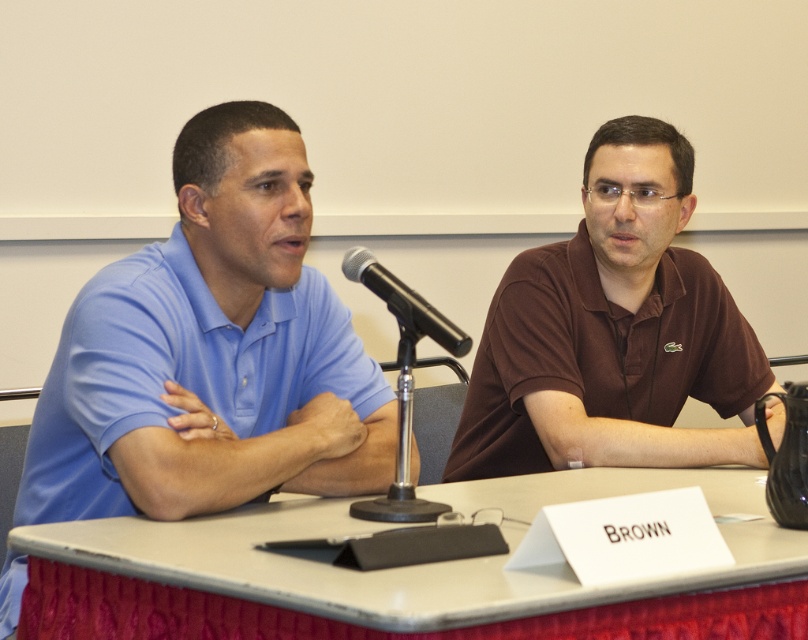
Can you confirm if matte blue polo shirt at left is positioned to the left of black metallic microphone at center?

Yes, matte blue polo shirt at left is to the left of black metallic microphone at center.

Is point (9, 593) in front of point (407, 292)?

Yes.

Locate an element on the screen. matte blue polo shirt at left is located at coordinates (x=211, y=353).

Find the location of a particular element. matte blue polo shirt at left is located at coordinates (x=211, y=353).

Which of these two, matte blue polo shirt at left or smooth white table at center, stands taller?

matte blue polo shirt at left is taller.

In order to click on matte blue polo shirt at left in this screenshot , I will do `click(211, 353)`.

I want to click on matte blue polo shirt at left, so click(211, 353).

Who is more forward, (x=663, y=308) or (x=447, y=570)?

Point (x=447, y=570)

Between brown matte shirt at center and smooth white table at center, which one has less height?

smooth white table at center is shorter.

In the scene shown: Measure the distance between brown matte shirt at center and camera.

The distance of brown matte shirt at center from camera is 1.89 meters.

Locate an element on the screen. The image size is (808, 640). brown matte shirt at center is located at coordinates (612, 332).